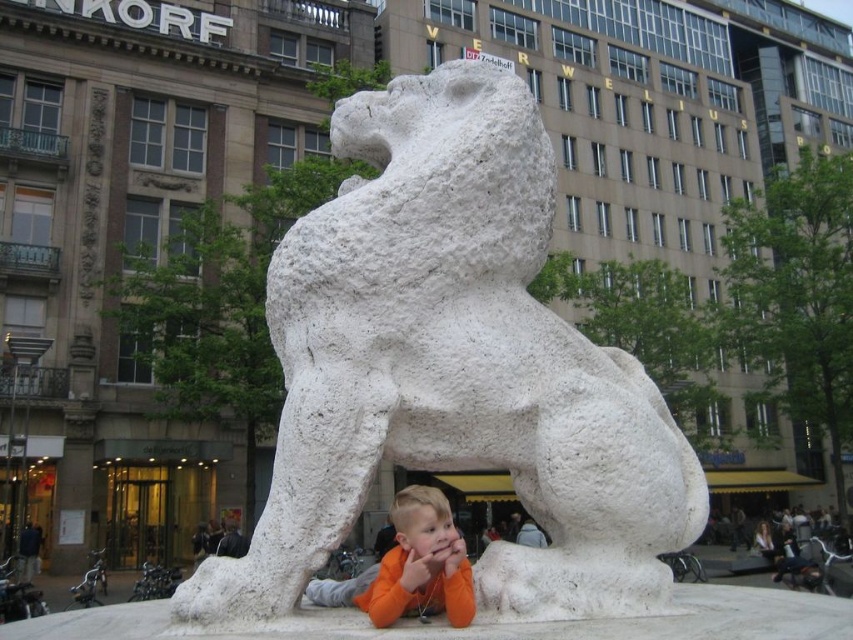
Does white stone lion at center have a smaller size compared to orange cotton shirt at lower center?

Yes.

The image size is (853, 640). Find the location of `white stone lion at center`. white stone lion at center is located at coordinates (453, 369).

Find the location of a particular element. This screenshot has height=640, width=853. white stone lion at center is located at coordinates (453, 369).